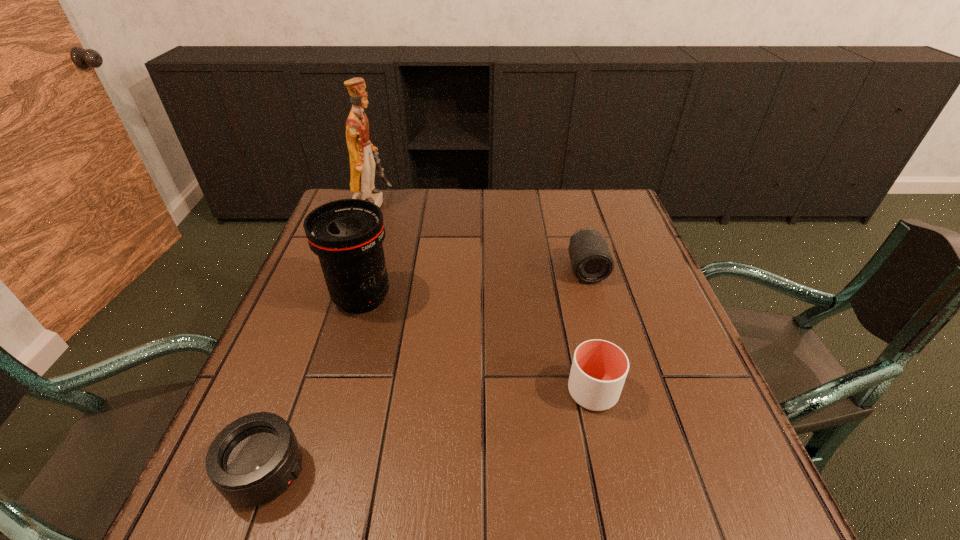
What are the coordinates of `the tallest object` in the screenshot? It's located at (363, 155).

Where is `the farthest object`? The width and height of the screenshot is (960, 540). the farthest object is located at coordinates (363, 155).

Locate an element on the screen. The image size is (960, 540). the second tallest object is located at coordinates (347, 234).

Image resolution: width=960 pixels, height=540 pixels. I want to click on the rightmost telephoto lens, so click(x=591, y=260).

Where is `the second nearest object`? Image resolution: width=960 pixels, height=540 pixels. the second nearest object is located at coordinates (599, 368).

Where is `the nearest telephoto lens`? The width and height of the screenshot is (960, 540). the nearest telephoto lens is located at coordinates (253, 460).

Where is `the nearest object`? This screenshot has height=540, width=960. the nearest object is located at coordinates (253, 460).

Locate an element on the screen. Image resolution: width=960 pixels, height=540 pixels. vacant space located on the front-facing side of the farthest object is located at coordinates (490, 202).

Find the location of a particular element. free space located on the right of the tallest telephoto lens is located at coordinates (540, 298).

The width and height of the screenshot is (960, 540). In order to click on free space located 0.280m on the surface of the rightmost telephoto lens in this screenshot , I will do `click(618, 382)`.